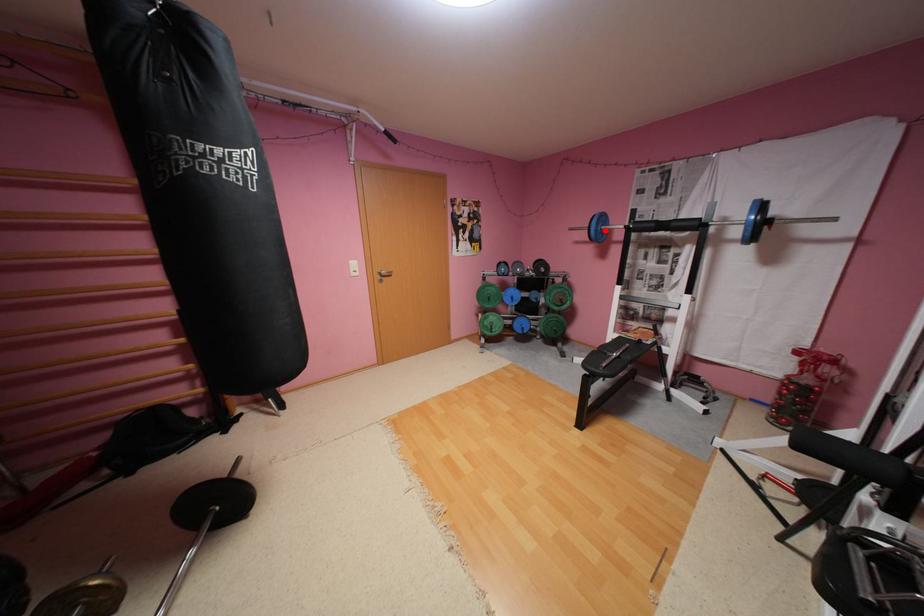
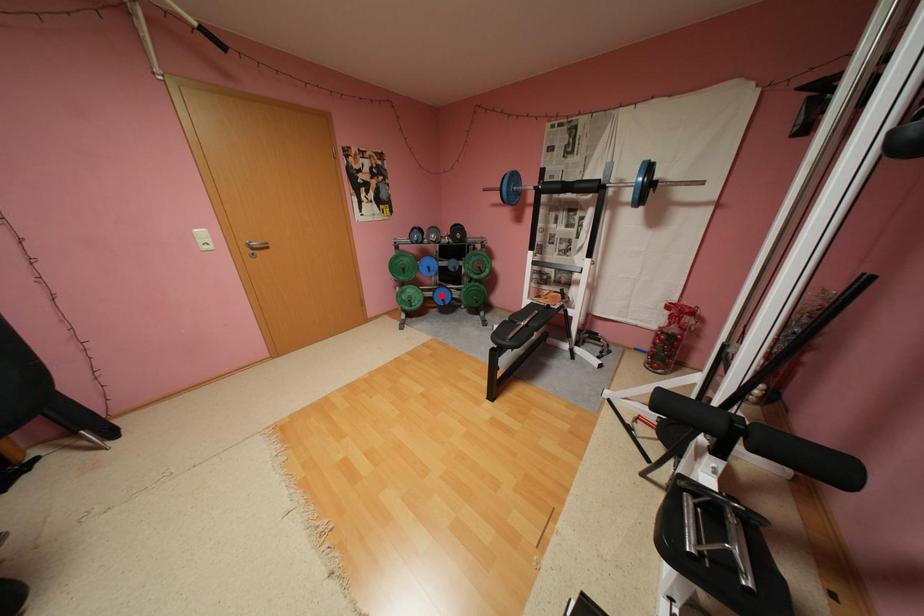
I am providing you with two images of the same scene from different viewpoints. A red point is marked on the first image and another point is marked on the second image. Are the points marked in image1 and image2 representing the same 3D position?

No